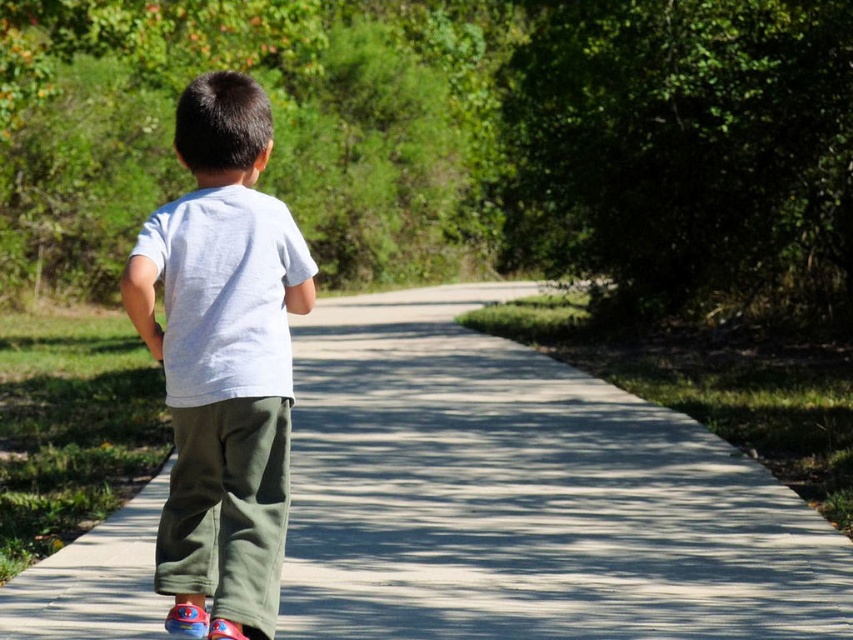
Consider the image. Is smooth concrete pavement at center bigger than white cotton shirt at center?

Yes.

Which of these two, smooth concrete pavement at center or white cotton shirt at center, stands taller?

With more height is white cotton shirt at center.

Does point (753, 508) come in front of point (161, 236)?

No, (753, 508) is behind (161, 236).

Find the location of a particular element. This screenshot has width=853, height=640. smooth concrete pavement at center is located at coordinates (525, 497).